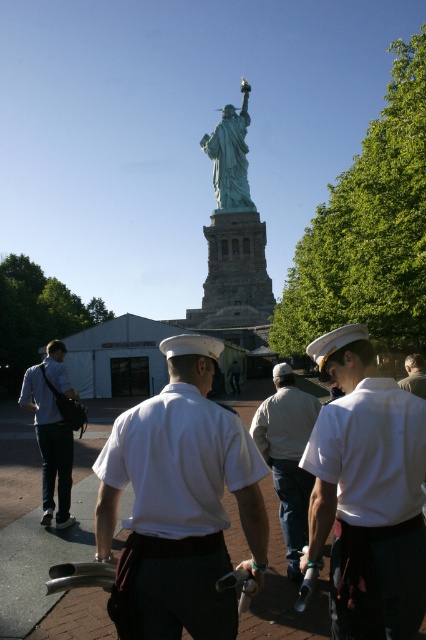
You are a tourist visiting Liberty Island and want to take a photo of the green patina statue at center without any people in the frame. Currently, there is a matte white uniform at center blocking the view. Based on their positions, can you determine if the statue is above or below the blocking person?

The matte white uniform at center is positioned under the green patina statue at center, meaning the statue is above the person. Therefore, you can take a photo looking upwards to capture the statue without the person blocking the view.

Consider the image. You are standing at the base of the Statue of Liberty and see a point marked at coordinates (287,456). What object is located at that point?

The point at coordinates (287,456) corresponds to the light gray cotton jacket at center.

You are a tourist standing at the entrance of Liberty Island. You see the matte white uniform at center and the green patina statue at center. Which object is positioned to the left from your viewpoint?

The matte white uniform at center is to the left of the green patina statue at center.